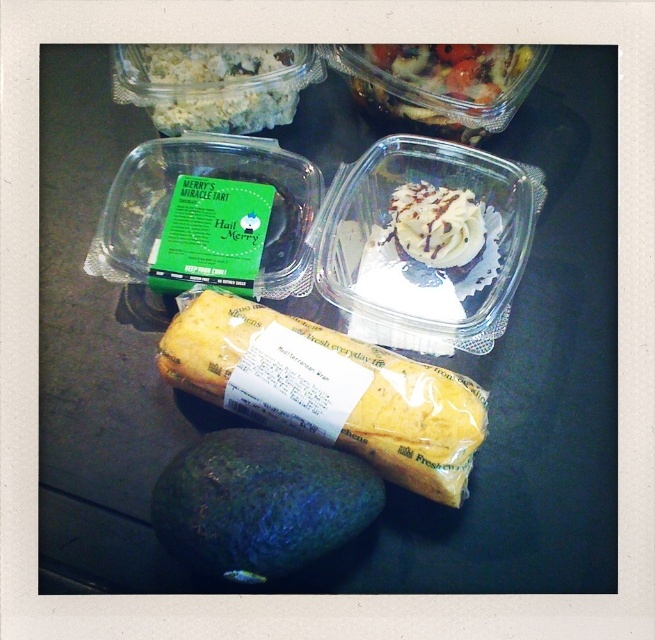
Between green matte avocado at lower center and shiny plastic salad at upper center, which one is positioned lower?

Positioned lower is green matte avocado at lower center.

Locate an element on the screen. The image size is (655, 640). green matte avocado at lower center is located at coordinates (259, 502).

The width and height of the screenshot is (655, 640). Find the location of `green matte avocado at lower center`. green matte avocado at lower center is located at coordinates (259, 502).

Who is higher up, yellowish-brown bread at center or shiny plastic salad at upper center?

shiny plastic salad at upper center

Is yellowish-brown bread at center to the left of shiny plastic salad at upper center from the viewer's perspective?

Indeed, yellowish-brown bread at center is positioned on the left side of shiny plastic salad at upper center.

Where is `yellowish-brown bread at center`? The height and width of the screenshot is (640, 655). yellowish-brown bread at center is located at coordinates (328, 390).

The width and height of the screenshot is (655, 640). I want to click on yellowish-brown bread at center, so click(328, 390).

Who is shorter, yellowish-brown bread at center or white crumbly rice at upper left?

white crumbly rice at upper left

Is point (413, 372) positioned after point (181, 67)?

No, (413, 372) is in front of (181, 67).

This screenshot has height=640, width=655. What do you see at coordinates (328, 390) in the screenshot? I see `yellowish-brown bread at center` at bounding box center [328, 390].

The width and height of the screenshot is (655, 640). In order to click on yellowish-brown bread at center in this screenshot , I will do `click(328, 390)`.